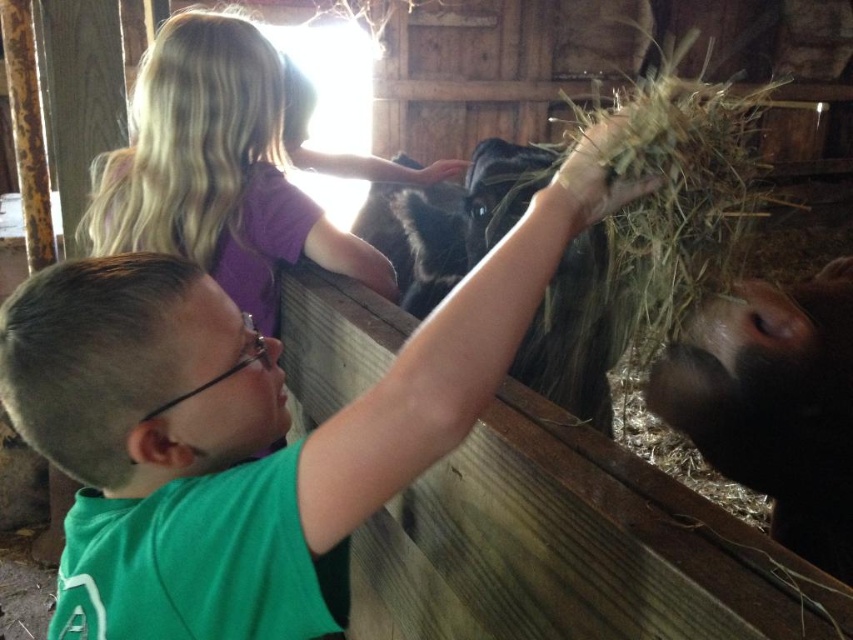
Question: Among these points, which one is nearest to the camera?

Choices:
 (A) (825, 394)
 (B) (16, 429)

Answer: (A)

Question: Observing the image, what is the correct spatial positioning of green matte shirt at upper center in reference to black matte cow at right?

Choices:
 (A) left
 (B) right

Answer: (A)

Question: From the image, what is the correct spatial relationship of green matte shirt at upper center in relation to black matte cow at right?

Choices:
 (A) right
 (B) left

Answer: (B)

Question: Is green matte shirt at upper center bigger than black matte cow at right?

Choices:
 (A) yes
 (B) no

Answer: (A)

Question: Which object appears closest to the camera in this image?

Choices:
 (A) green matte shirt at upper center
 (B) black matte cow at right

Answer: (A)